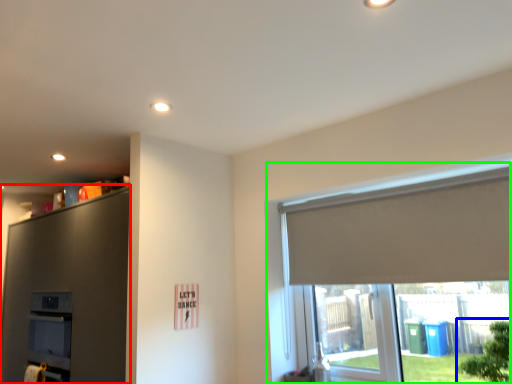
Question: Which object is positioned farthest from dresser (highlighted by a red box)? Select from tree (highlighted by a blue box) and window (highlighted by a green box).

Choices:
 (A) tree
 (B) window

Answer: (A)